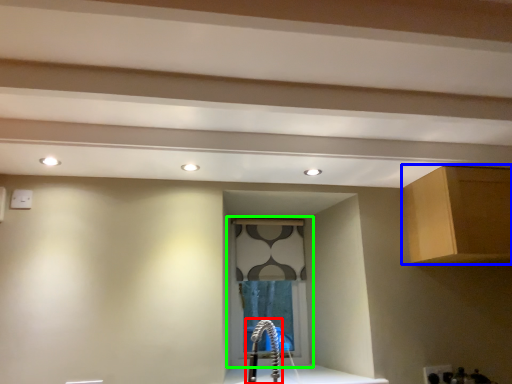
Question: Estimate the real-world distances between objects in this image. Which object is farther from faucet (highlighted by a red box), cabinetry (highlighted by a blue box) or window (highlighted by a green box)?

Choices:
 (A) cabinetry
 (B) window

Answer: (A)